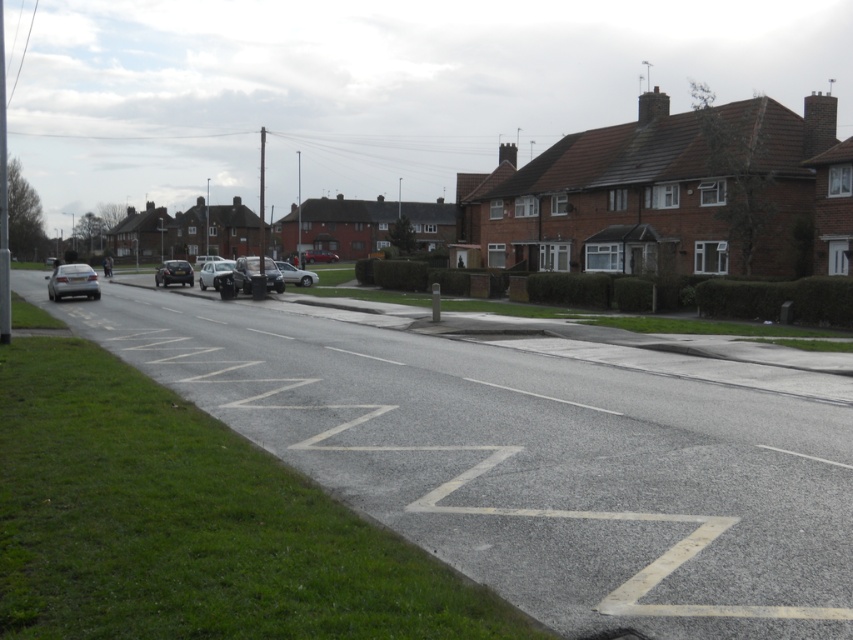
You are standing at the point with coordinates point (308, 259) and want to walk to the point with coordinates point (399, 371). Given the suburban street scene described, will you have to walk towards the direction of the terraced houses or away from them?

Since point (399, 371) is in front of point (308, 259), you will have to walk towards the direction of the terraced houses to reach it.